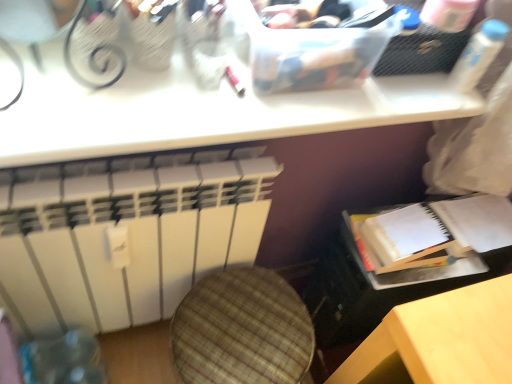
The image size is (512, 384). I want to click on white plastic table at upper center, so click(202, 112).

Considering the relative positions of white plastic table at upper center and white matte radiator at lower left in the image provided, is white plastic table at upper center to the left of white matte radiator at lower left from the viewer's perspective?

No, white plastic table at upper center is not to the left of white matte radiator at lower left.

From the image's perspective, is white plastic table at upper center on top of white matte radiator at lower left?

Indeed, from the image's perspective, white plastic table at upper center is shown above white matte radiator at lower left.

At what (x,y) coordinates should I click in order to perform the action: click on radiator beneath the white plastic table at upper center (from a real-world perspective). Please return your answer as a coordinate pair (x, y). This screenshot has width=512, height=384. Looking at the image, I should click on point(128,236).

Is point (205, 266) closer or farther from the camera than point (436, 217)?

Point (205, 266) is farther from the camera than point (436, 217).

The height and width of the screenshot is (384, 512). I want to click on journal that appears behind the white matte radiator at lower left, so click(439, 229).

Is white matte radiator at lower left smaller than plaid fabric swivel chair at lower left?

No.

Is white matte radiator at lower left shorter than plaid fabric swivel chair at lower left?

Incorrect, the height of white matte radiator at lower left does not fall short of that of plaid fabric swivel chair at lower left.

Which object is positioned more to the left, white matte radiator at lower left or plaid fabric swivel chair at lower left?

white matte radiator at lower left is more to the left.

Does white matte radiator at lower left turn towards white plastic bottle at upper right?

No, white matte radiator at lower left is not aimed at white plastic bottle at upper right.

Can we say white matte radiator at lower left lies outside white plastic bottle at upper right?

Yes, white matte radiator at lower left is outside of white plastic bottle at upper right.

The image size is (512, 384). Find the location of `bottle to the right of white matte radiator at lower left`. bottle to the right of white matte radiator at lower left is located at coordinates (478, 55).

Is white matte radiator at lower left spatially inside white plastic table at upper center, or outside of it?

white matte radiator at lower left is outside white plastic table at upper center.

In the image, is white matte radiator at lower left on the left side or the right side of white plastic table at upper center?

Based on their positions, white matte radiator at lower left is located to the left of white plastic table at upper center.

Can you confirm if white matte radiator at lower left is smaller than white plastic table at upper center?

Incorrect, white matte radiator at lower left is not smaller in size than white plastic table at upper center.

Is point (408, 253) farther from viewer compared to point (197, 184)?

That is True.

Is white paper journal at lower right not inside white matte radiator at lower left?

Yes, white paper journal at lower right is not within white matte radiator at lower left.

From a real-world perspective, between white paper journal at lower right and white matte radiator at lower left, who is vertically lower?

white matte radiator at lower left is physically lower.

Considering the relative positions of white paper journal at lower right and white matte radiator at lower left in the image provided, is white paper journal at lower right in front of white matte radiator at lower left?

No, it is behind white matte radiator at lower left.

Does white plastic bottle at upper right have a lesser height compared to plaid fabric swivel chair at lower left?

Correct, white plastic bottle at upper right is not as tall as plaid fabric swivel chair at lower left.

Is white plastic bottle at upper right in contact with plaid fabric swivel chair at lower left?

No, white plastic bottle at upper right is not making contact with plaid fabric swivel chair at lower left.

Consider the image. From the image's perspective, which is above, white plastic bottle at upper right or plaid fabric swivel chair at lower left?

white plastic bottle at upper right.

From a real-world perspective, which object stands above the other?

In real-world perspective, white plastic bottle at upper right is above.

Identify the location of radiator behind the white plastic table at upper center. (128, 236).

In the image, there is a white matte radiator at lower left. Find the location of `journal above it (from the image's perspective)`. journal above it (from the image's perspective) is located at coordinates (439, 229).

Looking at the image, which one is located further to white plastic table at upper center, plaid fabric swivel chair at lower left or white paper journal at lower right?

plaid fabric swivel chair at lower left.

From the image, which object appears to be nearer to white plastic bottle at upper right, white paper journal at lower right or white matte radiator at lower left?

white paper journal at lower right lies closer to white plastic bottle at upper right than the other object.

Based on their spatial positions, is white paper journal at lower right or white matte radiator at lower left closer to plaid fabric swivel chair at lower left?

white matte radiator at lower left is closer to plaid fabric swivel chair at lower left.

Based on their spatial positions, is plaid fabric swivel chair at lower left or white paper journal at lower right closer to white matte radiator at lower left?

plaid fabric swivel chair at lower left lies closer to white matte radiator at lower left than the other object.

Which object lies further to the anchor point white plastic table at upper center, white paper journal at lower right or white matte radiator at lower left?

The object further to white plastic table at upper center is white paper journal at lower right.

Looking at the image, which one is located further to white plastic bottle at upper right, plaid fabric swivel chair at lower left or white plastic table at upper center?

Based on the image, plaid fabric swivel chair at lower left appears to be further to white plastic bottle at upper right.

Estimate the real-world distances between objects in this image. Which object is further from white plastic bottle at upper right, plaid fabric swivel chair at lower left or white paper journal at lower right?

The object further to white plastic bottle at upper right is plaid fabric swivel chair at lower left.

Which object lies further to the anchor point white matte radiator at lower left, plaid fabric swivel chair at lower left or white plastic bottle at upper right?

The object further to white matte radiator at lower left is white plastic bottle at upper right.

Where is `swivel chair between white matte radiator at lower left and white paper journal at lower right in the horizontal direction`? swivel chair between white matte radiator at lower left and white paper journal at lower right in the horizontal direction is located at coordinates (242, 330).

I want to click on journal that lies between white plastic table at upper center and plaid fabric swivel chair at lower left from top to bottom, so [x=439, y=229].

In order to click on radiator between white plastic table at upper center and plaid fabric swivel chair at lower left vertically in this screenshot , I will do `click(128, 236)`.

Where is `journal that lies between white plastic bottle at upper right and plaid fabric swivel chair at lower left from top to bottom`? This screenshot has width=512, height=384. journal that lies between white plastic bottle at upper right and plaid fabric swivel chair at lower left from top to bottom is located at coordinates (439, 229).